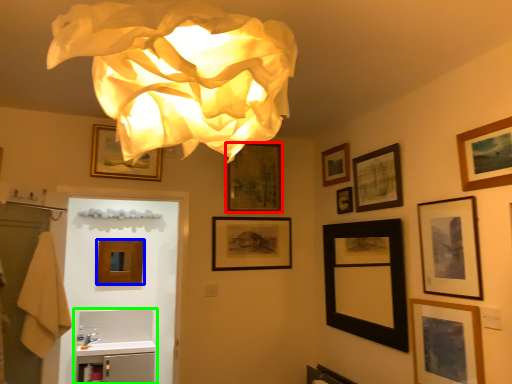
Question: Considering the real-world distances, which object is farthest from picture frame (highlighted by a red box)? picture frame (highlighted by a blue box) or sink (highlighted by a green box)?

Choices:
 (A) picture frame
 (B) sink

Answer: (B)